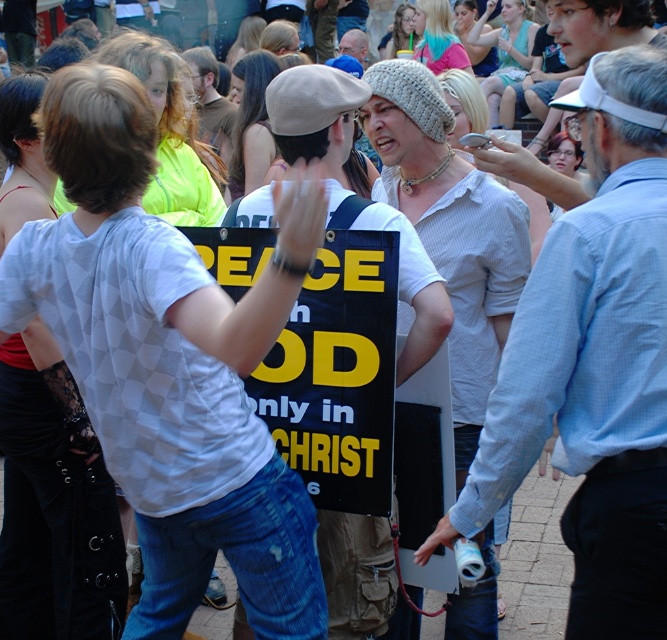
Question: Which of the following is the closest to the observer?

Choices:
 (A) light blue denim jeans at center
 (B) smooth blue shirt at center
 (C) light blue shirt at center
 (D) knitted wool beanie at center

Answer: (C)

Question: Does knitted wool cap at upper center have a lesser width compared to smooth blue shirt at center?

Choices:
 (A) yes
 (B) no

Answer: (A)

Question: Which object is farther from the camera taking this photo?

Choices:
 (A) knitted wool beanie at center
 (B) light brown hair at center

Answer: (B)

Question: Estimate the real-world distances between objects in this image. Which object is closer to the matte black hair at center?

Choices:
 (A) light brown hair at upper left
 (B) smooth beige beret at center
 (C) matte plastic cup at upper center

Answer: (B)

Question: Can you confirm if light blue shirt at center is positioned above matte black hair at center?

Choices:
 (A) yes
 (B) no

Answer: (B)

Question: Does light blue denim jeans at center appear on the left side of matte plastic cup at upper center?

Choices:
 (A) no
 (B) yes

Answer: (A)